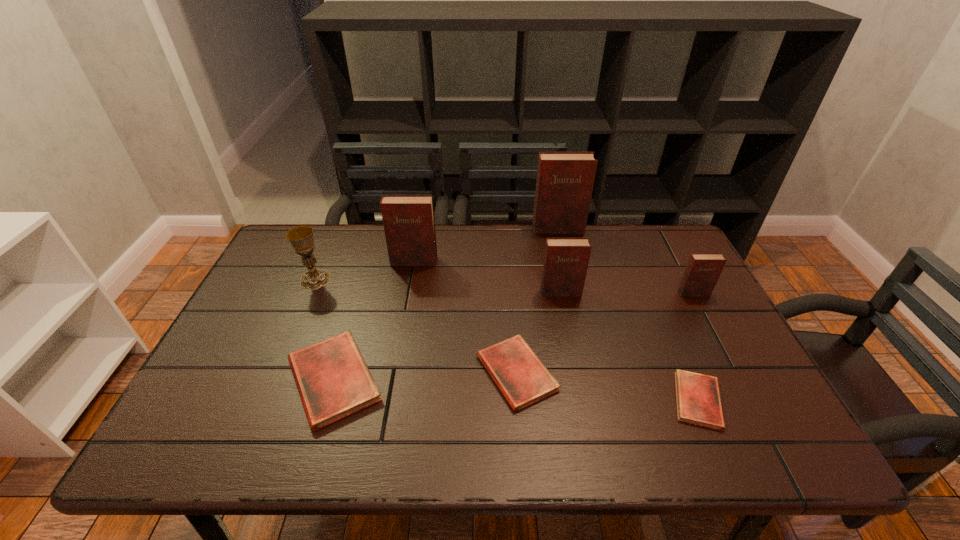
The height and width of the screenshot is (540, 960). Find the location of `the seventh tallest object`. the seventh tallest object is located at coordinates (523, 379).

You are a GUI agent. You are given a task and a screenshot of the screen. Output one action in this format:
    pyautogui.click(x=<x>, y=<y>)
    Task: Click on the second red diary from right to left
    
    Given the screenshot: What is the action you would take?
    pyautogui.click(x=523, y=379)

Image resolution: width=960 pixels, height=540 pixels. I want to click on the smallest red diary, so click(x=698, y=398).

Identify the location of the shortest diary. The image size is (960, 540). (698, 398).

Locate an element on the screen. This screenshot has height=540, width=960. free space located 0.150m on the front cover of the farthest reddish-brown diary is located at coordinates (565, 261).

In order to click on vacant position located 0.130m on the front cover of the sixth nearest diary in this screenshot , I will do `click(408, 295)`.

You are a GUI agent. You are given a task and a screenshot of the screen. Output one action in this format:
    pyautogui.click(x=<x>, y=<y>)
    Task: Click on the free space located on the front cover of the second smallest reddish-brown diary
    The image size is (960, 540).
    Given the screenshot: What is the action you would take?
    pyautogui.click(x=579, y=384)

Identify the location of vacant space situated 0.170m on the right of the gold chalice. This screenshot has height=540, width=960. (387, 280).

Identify the location of free space located on the front cover of the smallest reddish-brown diary. (738, 377).

The image size is (960, 540). I want to click on vacant area located 0.290m on the right of the leftmost red diary, so click(509, 380).